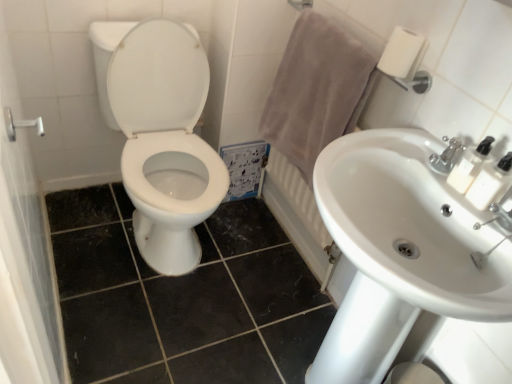
Where is `free space on the front side of white glossy toilet at center`? free space on the front side of white glossy toilet at center is located at coordinates (140, 309).